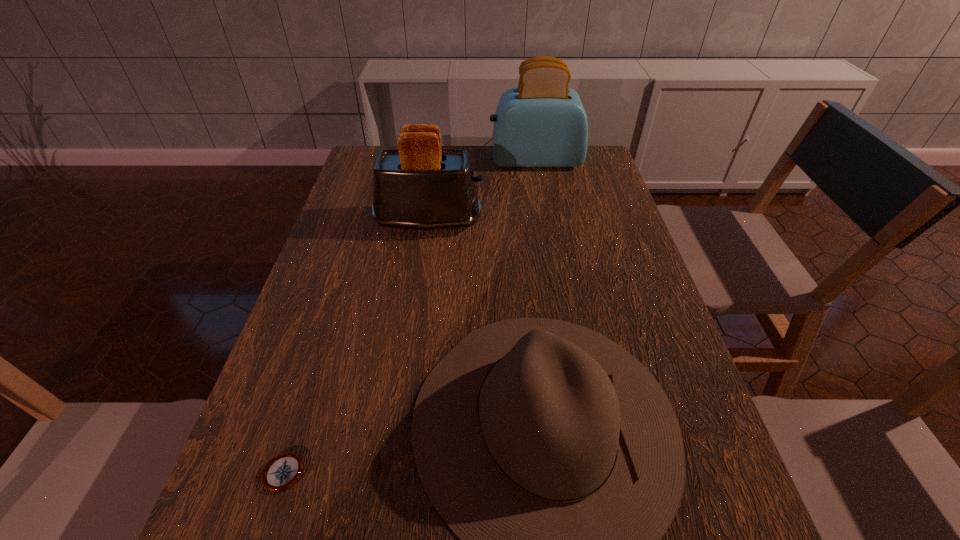
This screenshot has height=540, width=960. I want to click on the right toaster, so click(x=541, y=123).

In order to click on the farther toaster in this screenshot , I will do `click(541, 123)`.

The width and height of the screenshot is (960, 540). In order to click on the shorter toaster in this screenshot , I will do `click(421, 186)`.

I want to click on the third shortest object, so click(421, 186).

Identify the location of the shortest object. This screenshot has width=960, height=540. (283, 471).

The width and height of the screenshot is (960, 540). What are the coordinates of `vacant space located on the side of the farthest object with the lever` in the screenshot? It's located at (403, 160).

The image size is (960, 540). I want to click on vacant area located 0.140m on the side of the farthest object with the lever, so click(x=449, y=160).

Find the location of a particular element. Image resolution: width=960 pixels, height=540 pixels. free space located 0.260m on the side of the farthest object with the lever is located at coordinates (415, 160).

Find the location of a particular element. free region located on the side of the third shortest object with the control lever is located at coordinates (547, 221).

You are a GUI agent. You are given a task and a screenshot of the screen. Output one action in this format:
    pyautogui.click(x=<x>, y=<y>)
    Task: Click on the vacant space located 0.090m on the right of the compass
    This screenshot has width=960, height=540.
    Given the screenshot: What is the action you would take?
    pyautogui.click(x=355, y=473)